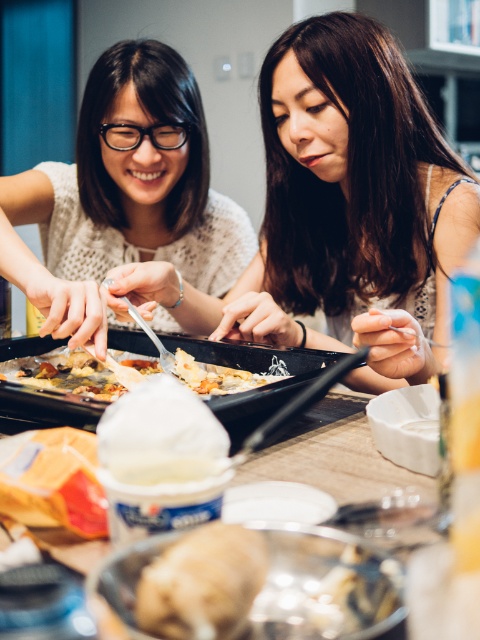
Is black non-stick tray at center to the right of white matte plate at center from the viewer's perspective?

In fact, black non-stick tray at center is to the left of white matte plate at center.

Who is more distant from viewer, (1,342) or (252,496)?

Positioned behind is point (1,342).

I want to click on black non-stick tray at center, so click(253, 371).

You are a GUI agent. You are given a task and a screenshot of the screen. Output one action in this format:
    pyautogui.click(x=<x>, y=<y>)
    Task: Click on the black non-stick tray at center
    The image size is (480, 640).
    Given the screenshot: What is the action you would take?
    253,371

Based on the photo, does matte black tray at center appear over golden crispy pastry at center?

Indeed, matte black tray at center is positioned over golden crispy pastry at center.

Who is higher up, matte black tray at center or golden crispy pastry at center?

Positioned higher is matte black tray at center.

Is point (368, 134) behind point (49, 380)?

Yes, point (368, 134) is behind point (49, 380).

This screenshot has height=640, width=480. In order to click on matte black tray at center in this screenshot , I will do `click(352, 204)`.

Who is higher up, matte black tray at center or black non-stick tray at center?

matte black tray at center is above.

Can you confirm if matte black tray at center is positioned below black non-stick tray at center?

Actually, matte black tray at center is above black non-stick tray at center.

Does point (325, 106) come in front of point (239, 356)?

No.

You are a GUI agent. You are given a task and a screenshot of the screen. Output one action in this format:
    pyautogui.click(x=<x>, y=<y>)
    Task: Click on the matte black tray at center
    Image resolution: width=480 pixels, height=640 pixels.
    Given the screenshot: What is the action you would take?
    pyautogui.click(x=352, y=204)